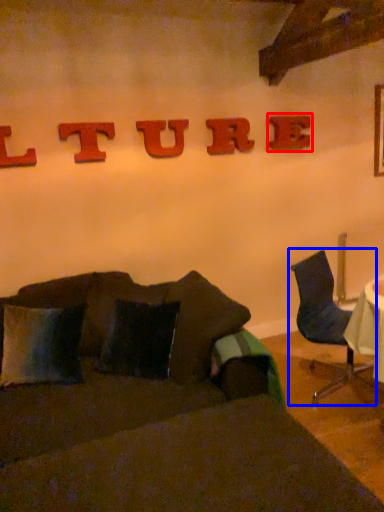
Question: Which object appears farthest to the camera in this image, alphabet (highlighted by a red box) or chair (highlighted by a blue box)?

Choices:
 (A) alphabet
 (B) chair

Answer: (A)